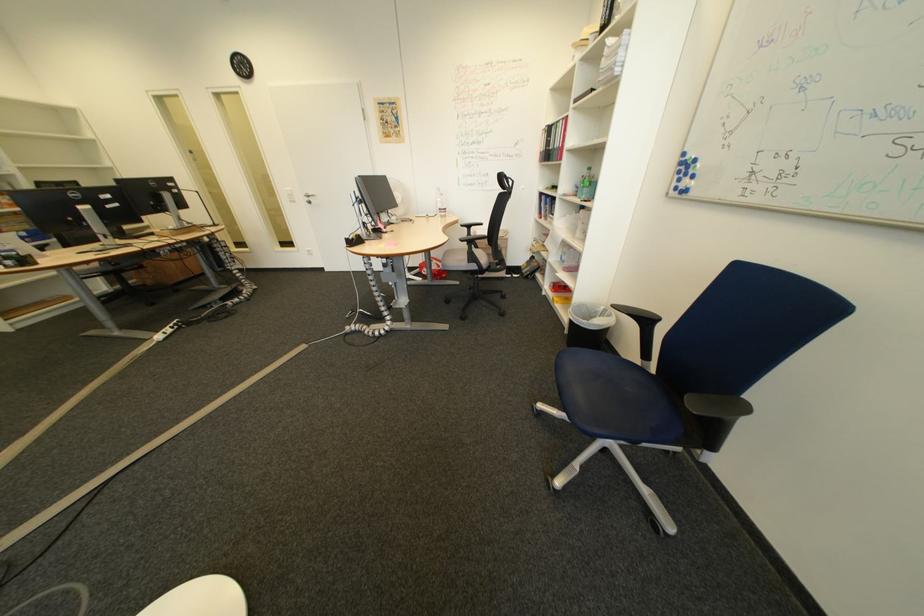
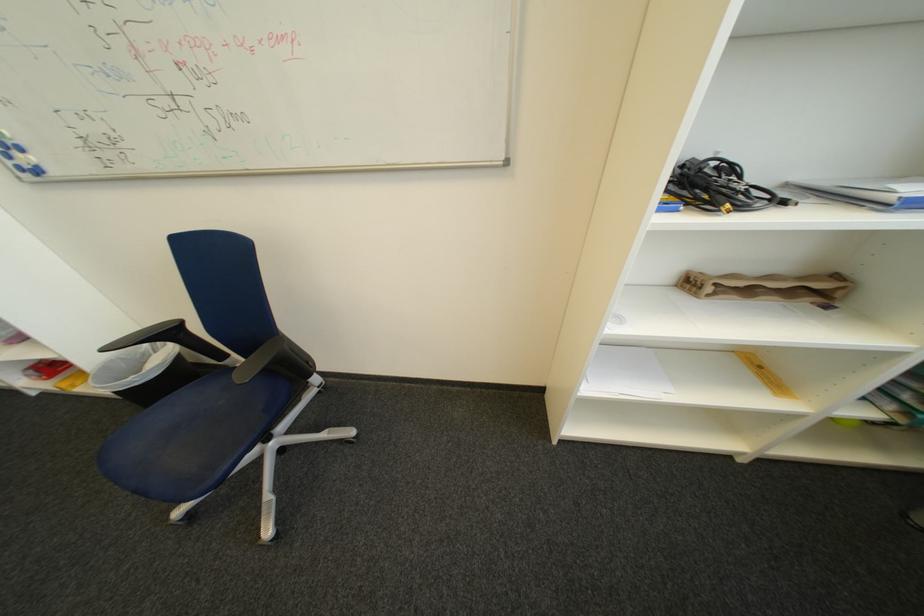
Where in the second image is the point corresponding to (x=600, y=308) from the first image?

(134, 360)